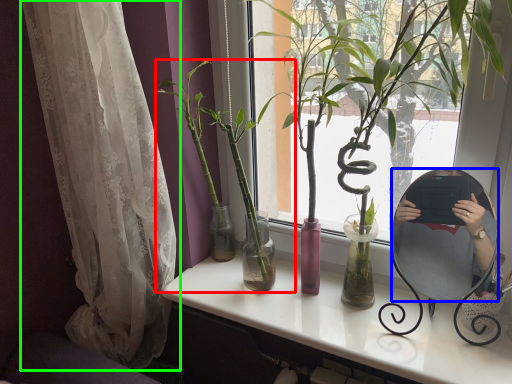
Question: Estimate the real-world distances between objects in this image. Which object is farther from houseplant (highlighted by a red box), mirror (highlighted by a blue box) or curtain (highlighted by a green box)?

Choices:
 (A) mirror
 (B) curtain

Answer: (A)